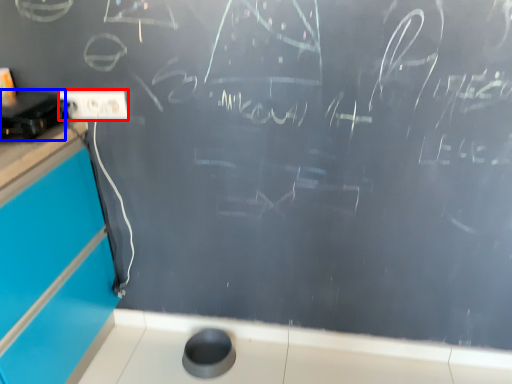
Question: Which of the following is the farthest to the observer, electric outlet (highlighted by a red box) or appliance (highlighted by a blue box)?

Choices:
 (A) electric outlet
 (B) appliance

Answer: (A)